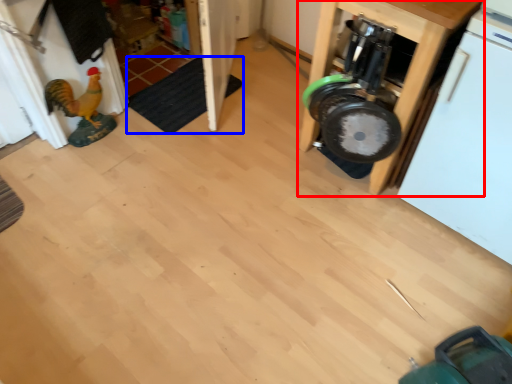
Question: Which object appears farthest to the camera in this image, furniture (highlighted by a red box) or mat (highlighted by a blue box)?

Choices:
 (A) furniture
 (B) mat

Answer: (B)